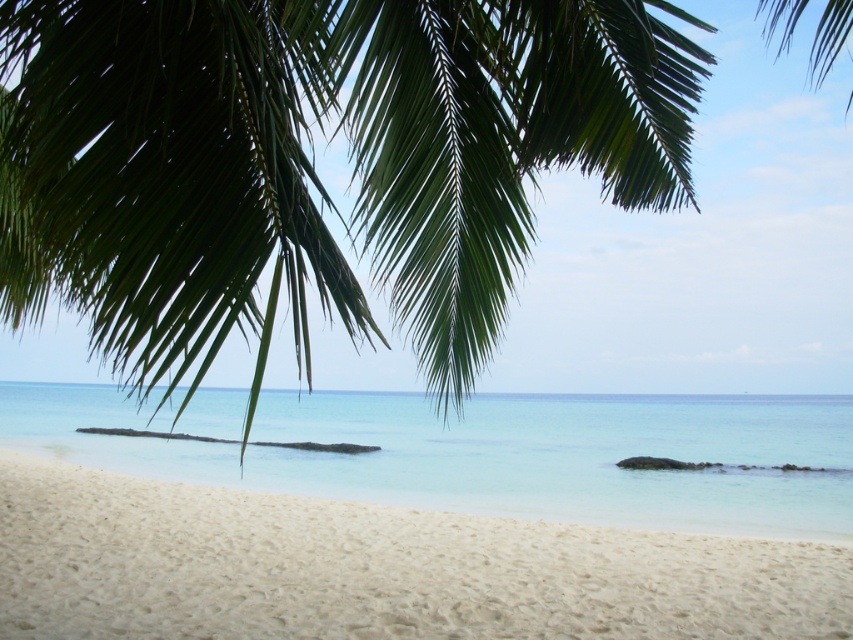
Consider the image. You are standing at the center of the image and want to walk to the white sandy beach at lower left. According to the coordinates provided, in which direction should you move?

The white sandy beach at lower left is located at point (376, 568). Since the coordinates are based on a standard image coordinate system where the origin is the top left corner, the lower left position would require moving downward and to the left from the center. However, since the beach is already at the lower left, you should move towards the lower left direction to reach it.

You are a photographer planning to capture the beach scene. You want to ensure that the green leafy palm tree at upper left and the clear water at lower center are both visible in your shot. Based on their sizes in the image, which object will take up more of the frame?

The clear water at lower center occupies more space in the frame than the green leafy palm tree at upper left, so it will take up more of the frame.

You are a hiker who wants to reach the white sandy beach at lower left from your current position. The green leafy palm tree at upper left is blocking your path. Can you walk around the tree to get to the beach?

The distance between the green leafy palm tree at upper left and the white sandy beach at lower left is 11.16 feet, so yes, you can walk around the tree to reach the beach since there is enough space between them.